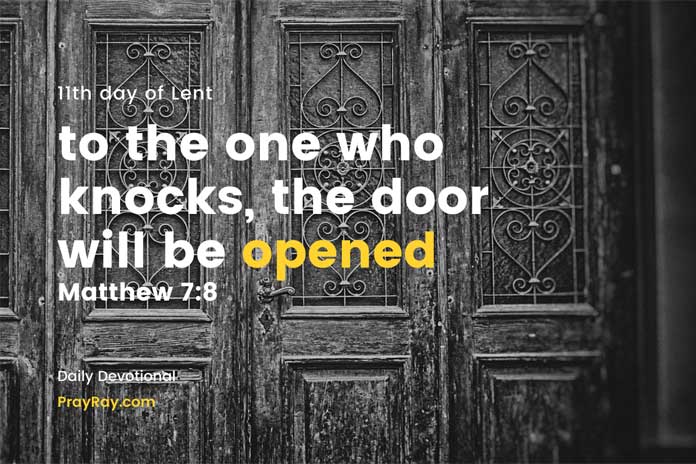
What are the coordinates of `windows` in the screenshot? It's located at (3, 129), (156, 65), (370, 105), (539, 150).